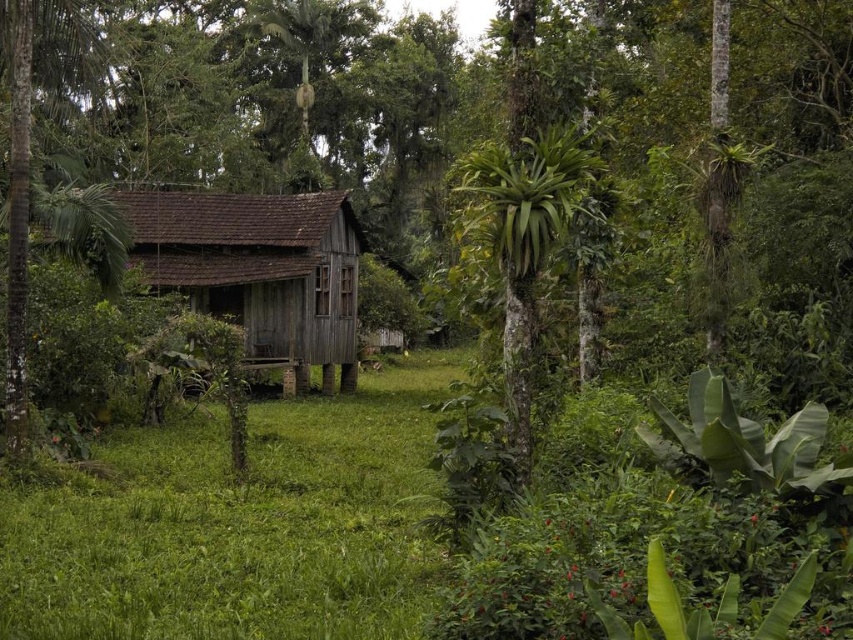
Question: Does green grass at center appear on the left side of weathered wood hut at center?

Choices:
 (A) yes
 (B) no

Answer: (B)

Question: Is green grass at center smaller than weathered wood hut at center?

Choices:
 (A) yes
 (B) no

Answer: (A)

Question: Which point is closer to the camera taking this photo?

Choices:
 (A) (386, 486)
 (B) (332, 225)

Answer: (A)

Question: Is green grass at center to the right of weathered wood hut at center from the viewer's perspective?

Choices:
 (A) no
 (B) yes

Answer: (B)